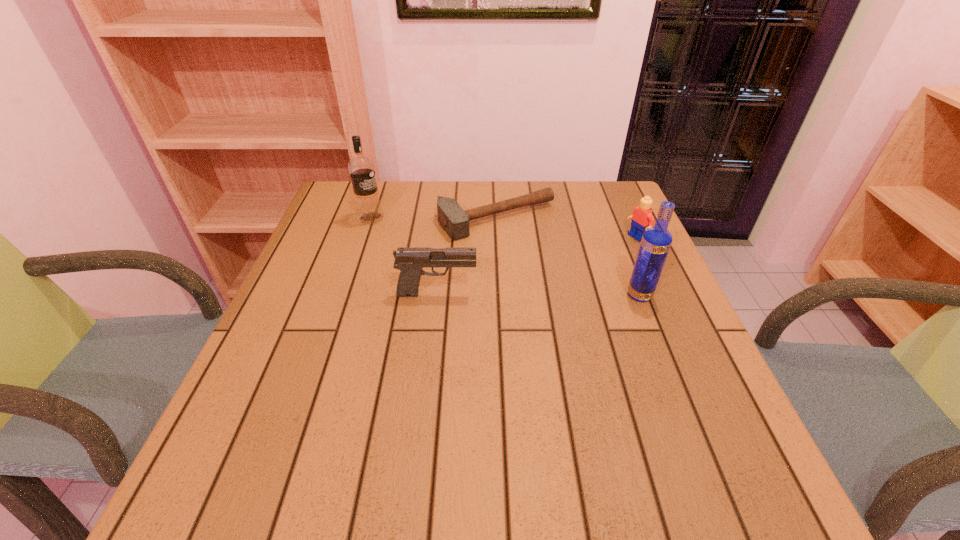
I want to click on vacant space located 0.370m on the label of the farther vodka, so click(489, 274).

Where is `vacant space situated 0.150m on the striking surface of the shortest object`? vacant space situated 0.150m on the striking surface of the shortest object is located at coordinates (557, 272).

Identify the location of free point located 0.060m on the striking surface of the shortest object. (538, 252).

Find the location of a particular element. This screenshot has height=540, width=960. vacant space located on the striking surface of the shortest object is located at coordinates (614, 334).

What are the coordinates of `vacant point located 0.110m on the face of the Lego` in the screenshot? It's located at 600,255.

Locate an element on the screen. Image resolution: width=960 pixels, height=540 pixels. free space located 0.310m on the face of the Lego is located at coordinates (538, 284).

Where is `free space located on the face of the Lego`? The width and height of the screenshot is (960, 540). free space located on the face of the Lego is located at coordinates (544, 280).

What are the coordinates of `vodka at the far edge` in the screenshot? It's located at (361, 168).

Locate an element on the screen. hammer at the far edge is located at coordinates (455, 221).

Identify the location of object that is at the left edge. (361, 168).